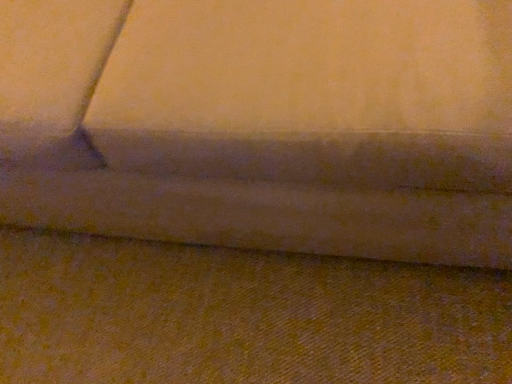
Locate an element on the screen. velvet-like fabric couch at center is located at coordinates (266, 124).

Describe the element at coordinates (266, 124) in the screenshot. I see `velvet-like fabric couch at center` at that location.

Locate an element on the screen. This screenshot has width=512, height=384. yellow fabric at lower center is located at coordinates coord(241,317).

The width and height of the screenshot is (512, 384). What do you see at coordinates (241, 317) in the screenshot?
I see `yellow fabric at lower center` at bounding box center [241, 317].

I want to click on velvet-like fabric couch at center, so click(x=266, y=124).

In the scene shown: Considering the relative positions of yellow fabric at lower center and velvet-like fabric couch at center in the image provided, is yellow fabric at lower center to the right of velvet-like fabric couch at center from the viewer's perspective?

Yes, yellow fabric at lower center is to the right of velvet-like fabric couch at center.

Which object is further away from the camera, yellow fabric at lower center or velvet-like fabric couch at center?

Positioned behind is yellow fabric at lower center.

Is point (104, 318) positioned in front of point (212, 182)?

No.

From the image's perspective, is yellow fabric at lower center on top of velvet-like fabric couch at center?

Actually, yellow fabric at lower center appears below velvet-like fabric couch at center in the image.

From a real-world perspective, relative to velvet-like fabric couch at center, is yellow fabric at lower center vertically above or below?

In terms of real-world spatial position, yellow fabric at lower center is below velvet-like fabric couch at center.

Is yellow fabric at lower center wider or thinner than velvet-like fabric couch at center?

In the image, yellow fabric at lower center appears to be more narrow than velvet-like fabric couch at center.

Considering the relative sizes of yellow fabric at lower center and velvet-like fabric couch at center in the image provided, is yellow fabric at lower center taller than velvet-like fabric couch at center?

No, yellow fabric at lower center is not taller than velvet-like fabric couch at center.

Is yellow fabric at lower center smaller than velvet-like fabric couch at center?

Yes.

Do you think yellow fabric at lower center is within velvet-like fabric couch at center, or outside of it?

yellow fabric at lower center is spatially situated outside velvet-like fabric couch at center.

Would you consider yellow fabric at lower center to be distant from velvet-like fabric couch at center?

Actually, yellow fabric at lower center and velvet-like fabric couch at center are a little close together.

Could you tell me if yellow fabric at lower center is facing velvet-like fabric couch at center?

No, yellow fabric at lower center is not turned towards velvet-like fabric couch at center.

What's the angular difference between yellow fabric at lower center and velvet-like fabric couch at center's facing directions?

The angular difference between yellow fabric at lower center and velvet-like fabric couch at center is 178 degrees.

How distant is yellow fabric at lower center from velvet-like fabric couch at center?

yellow fabric at lower center and velvet-like fabric couch at center are 12.43 inches apart from each other.

Locate an element on the screen. Image resolution: width=512 pixels, height=384 pixels. surface below the velvet-like fabric couch at center (from the image's perspective) is located at coordinates (241, 317).

Which is more to the right, velvet-like fabric couch at center or yellow fabric at lower center?

yellow fabric at lower center.

Does velvet-like fabric couch at center come in front of yellow fabric at lower center?

Yes, the depth of velvet-like fabric couch at center is less than that of yellow fabric at lower center.

Is point (245, 31) positioned after point (509, 380)?

No, it is not.

From the image's perspective, is velvet-like fabric couch at center located above or below yellow fabric at lower center?

Clearly, from the image's perspective, velvet-like fabric couch at center is above yellow fabric at lower center.

From a real-world perspective, is velvet-like fabric couch at center beneath yellow fabric at lower center?

No, from a real-world perspective, velvet-like fabric couch at center is not beneath yellow fabric at lower center.

Can you confirm if velvet-like fabric couch at center is thinner than yellow fabric at lower center?

No, velvet-like fabric couch at center is not thinner than yellow fabric at lower center.

In the scene shown: Which of these two, velvet-like fabric couch at center or yellow fabric at lower center, stands shorter?

yellow fabric at lower center.

Is velvet-like fabric couch at center smaller than yellow fabric at lower center?

No, velvet-like fabric couch at center is not smaller than yellow fabric at lower center.

Choose the correct answer: Is velvet-like fabric couch at center inside yellow fabric at lower center or outside it?

velvet-like fabric couch at center exists outside the volume of yellow fabric at lower center.

Is velvet-like fabric couch at center directly adjacent to yellow fabric at lower center?

velvet-like fabric couch at center is not next to yellow fabric at lower center, and they're not touching.

Is velvet-like fabric couch at center facing away from yellow fabric at lower center?

No, velvet-like fabric couch at center is not facing the opposite direction of yellow fabric at lower center.

The image size is (512, 384). What are the coordinates of `surface behind the velvet-like fabric couch at center` in the screenshot? It's located at (241, 317).

Image resolution: width=512 pixels, height=384 pixels. Find the location of `studio couch in front of the yellow fabric at lower center`. studio couch in front of the yellow fabric at lower center is located at coordinates (266, 124).

Image resolution: width=512 pixels, height=384 pixels. What are the coordinates of `surface behind the velvet-like fabric couch at center` in the screenshot? It's located at (241, 317).